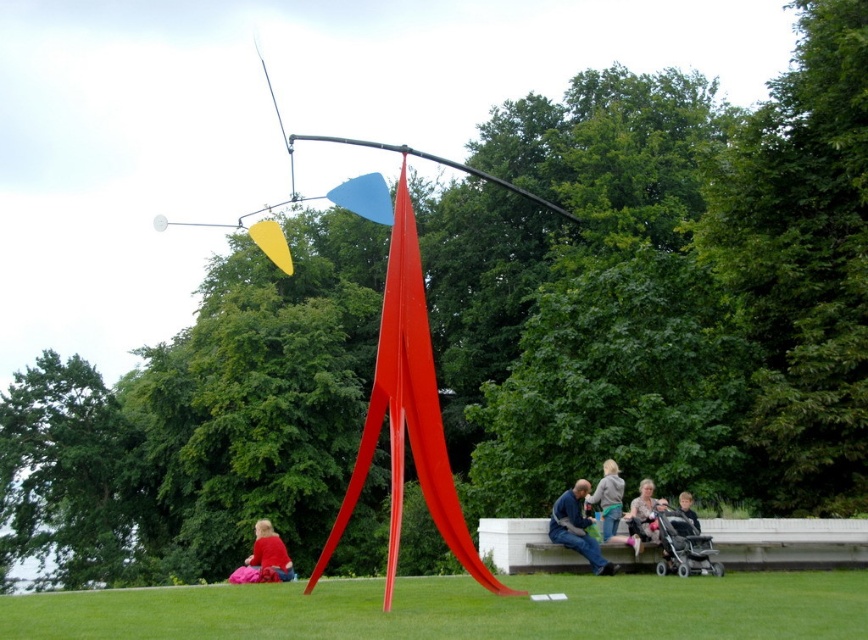
You are an artist setting up an exhibition. You have two items to place in the foreground of the sculpture scene described. The items are the red fabric at lower left and the matte pink sweater at lower center. According to the scene description, which item should you place first if you want to follow the left to right arrangement as seen from the viewer?

You should place the red fabric at lower left first because it is positioned to the left of the matte pink sweater at lower center, following a left to right arrangement.

You are standing in front of the modern sculpture and want to take a photo. There are two points marked in the image at coordinates point (615,483) and point (681,509). Which point is closer to your camera lens?

Point (615,483) is further to the camera than point (681,509), so the point closer to the camera lens is point (681,509).

You are an artist planning to paint this scene. You need to decide which object to focus on first based on their sizes. Which object should you choose to paint first, the red fabric at lower left or the matte pink sweater at lower center?

The red fabric at lower left is larger in size than the matte pink sweater at lower center, so you should paint the red fabric at lower left first to capture its prominent size in the scene.